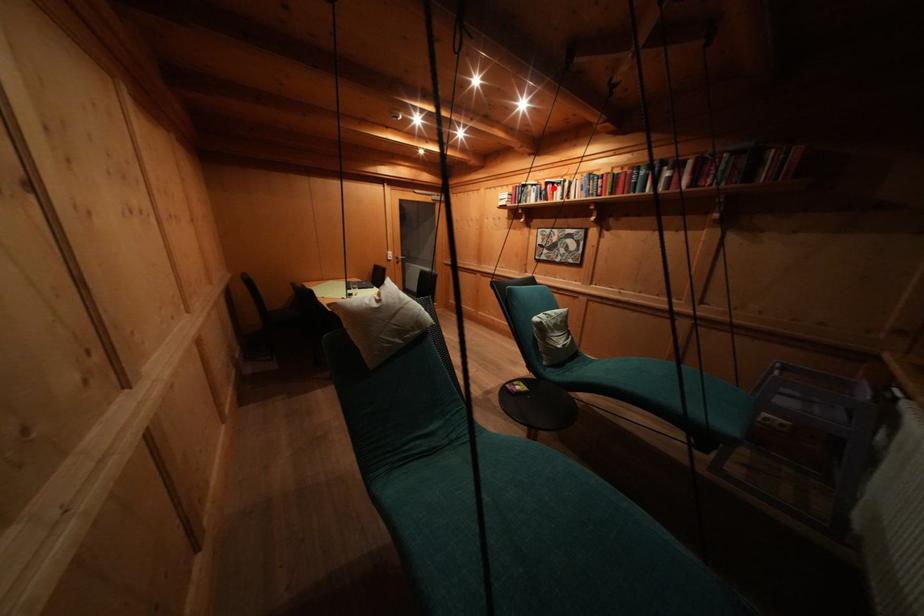
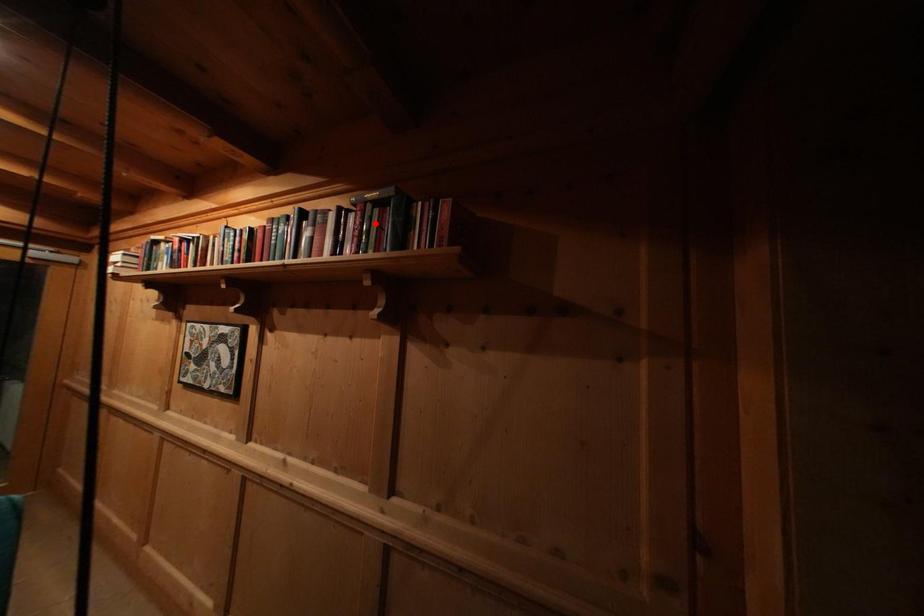
I am providing you with two images of the same scene from different viewpoints. A red point is marked on the first image and another point is marked on the second image. Do the highlighted points in image1 and image2 indicate the same real-world spot?

No